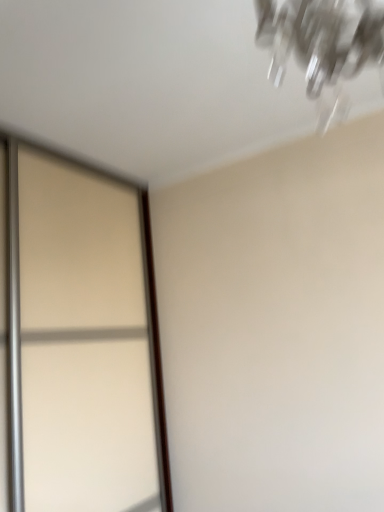
Question: Should I look upward or downward to see translucent glass screen door at left?

Choices:
 (A) down
 (B) up

Answer: (A)

Question: Is translucent glass screen door at left closer to the viewer compared to clear glass chandelier at upper right?

Choices:
 (A) yes
 (B) no

Answer: (B)

Question: Is translucent glass screen door at left outside of clear glass chandelier at upper right?

Choices:
 (A) yes
 (B) no

Answer: (A)

Question: Is translucent glass screen door at left placed right next to clear glass chandelier at upper right?

Choices:
 (A) no
 (B) yes

Answer: (A)

Question: Does translucent glass screen door at left appear on the right side of clear glass chandelier at upper right?

Choices:
 (A) no
 (B) yes

Answer: (A)

Question: From the image's perspective, does translucent glass screen door at left appear higher than clear glass chandelier at upper right?

Choices:
 (A) yes
 (B) no

Answer: (B)

Question: Would you say clear glass chandelier at upper right is part of translucent glass screen door at left's contents?

Choices:
 (A) no
 (B) yes

Answer: (A)

Question: From the image's perspective, is clear glass chandelier at upper right above translucent glass screen door at left?

Choices:
 (A) no
 (B) yes

Answer: (B)

Question: Is clear glass chandelier at upper right next to translucent glass screen door at left?

Choices:
 (A) no
 (B) yes

Answer: (A)

Question: Does clear glass chandelier at upper right have a lesser height compared to translucent glass screen door at left?

Choices:
 (A) yes
 (B) no

Answer: (A)

Question: Can you confirm if clear glass chandelier at upper right is positioned to the left of translucent glass screen door at left?

Choices:
 (A) yes
 (B) no

Answer: (B)

Question: From a real-world perspective, is clear glass chandelier at upper right beneath translucent glass screen door at left?

Choices:
 (A) no
 (B) yes

Answer: (A)

Question: Is clear glass chandelier at upper right outside translucent glass screen door at left?

Choices:
 (A) yes
 (B) no

Answer: (A)

Question: Does point (110, 312) appear closer or farther from the camera than point (273, 8)?

Choices:
 (A) closer
 (B) farther

Answer: (B)